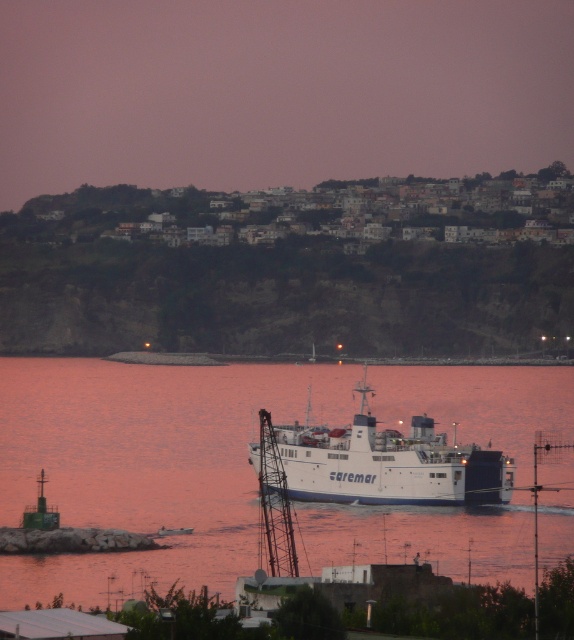
You are a sailor navigating a boat and need to avoid hitting the ferry. You see the point marked at coordinates (145, 464) which is white matte water at center. Where should you steer your boat to avoid the ferry?

The point at (145, 464) marks the white matte water at center, which is the location of the calm sea. To avoid the ferry, steer your boat away from the ferry towards the white matte water at center where there are no obstructions.

You are a passenger on the white matte ferry at center and want to look out to the direction where the white matte water at center is located. Which direction should you face?

The white matte water at center is to the left of the white matte ferry at center, so you should face to the left to look towards the white matte water at center.